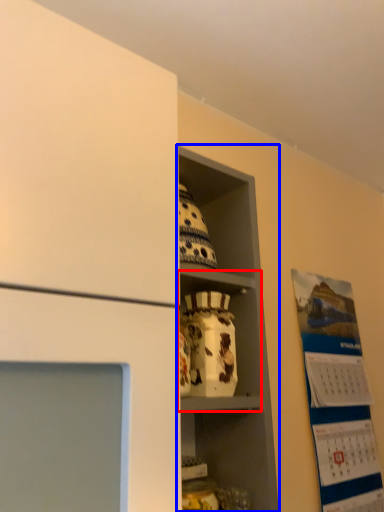
Question: Which of the following is the closest to the observer, cabinet (highlighted by a red box) or shelf (highlighted by a blue box)?

Choices:
 (A) cabinet
 (B) shelf

Answer: (B)